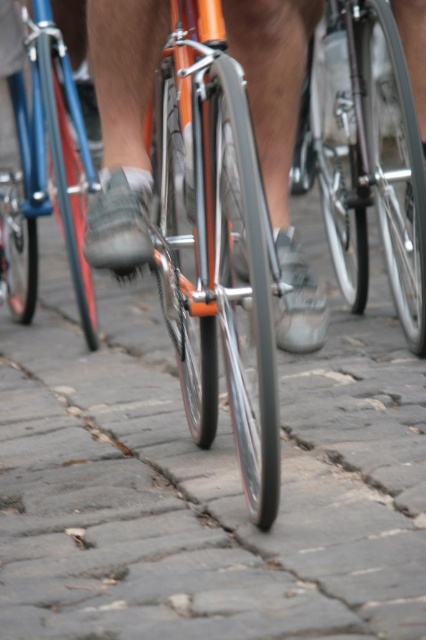
You are a photographer trying to capture both the shiny orange frame at center and the shiny silver bicycle at center in one shot. Since you want to ensure both are visible, which object should you position closer to the left side of your camera frame?

You should position the shiny orange frame at center closer to the left side of your camera frame because it is already to the left of the shiny silver bicycle at center in the scene.

Looking at this image, you are a delivery person who needs to choose between the shiny silver bicycle at center and the shiny blue frame at center for a quick delivery. Which bicycle would you choose based on their heights?

The shiny silver bicycle at center is shorter than the shiny blue frame at center, so you should choose the shiny silver bicycle at center for easier handling and maneuvering during the delivery.